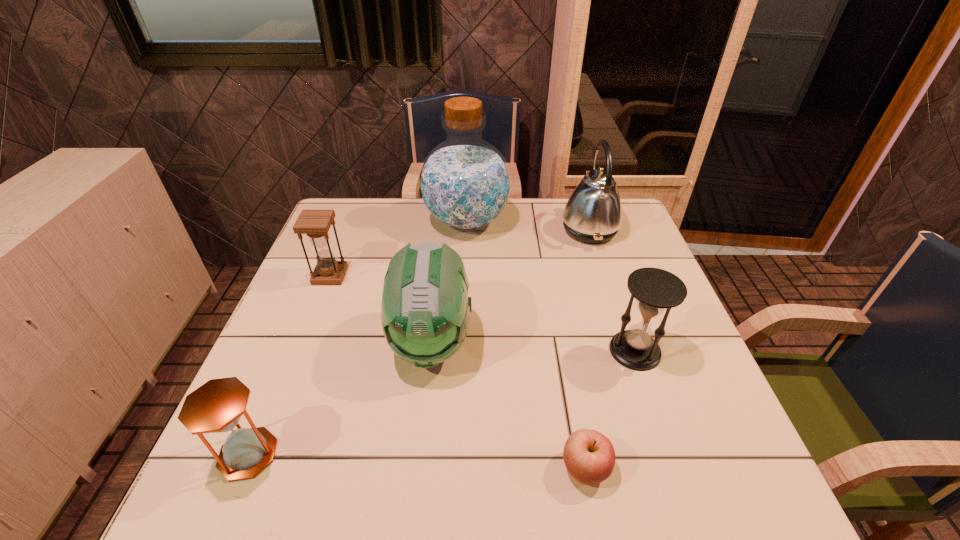
Find the location of a particular element. This screenshot has width=960, height=540. apple at the near edge is located at coordinates (589, 456).

Locate an element on the screen. The image size is (960, 540). kettle that is at the right edge is located at coordinates (593, 214).

Where is `hourglass that is at the right edge`? This screenshot has width=960, height=540. hourglass that is at the right edge is located at coordinates (655, 290).

I want to click on object present at the near left corner, so click(215, 407).

Where is `object located in the far right corner section of the desktop`? object located in the far right corner section of the desktop is located at coordinates (593, 214).

The image size is (960, 540). I want to click on free space at the far edge, so 490,231.

Find the location of a particular element. free spot at the near edge of the desktop is located at coordinates (407, 480).

At what (x,y) coordinates should I click in order to perform the action: click on free space at the left edge of the desktop. Please return your answer as a coordinate pair (x, y). Looking at the image, I should click on (320, 330).

You are a GUI agent. You are given a task and a screenshot of the screen. Output one action in this format:
    pyautogui.click(x=<x>, y=<y>)
    Task: Click on the free space at the right edge of the desktop
    
    Given the screenshot: What is the action you would take?
    pyautogui.click(x=684, y=370)

The image size is (960, 540). In the image, there is a desktop. What are the coordinates of `vacant space at the far left corner` in the screenshot? It's located at (348, 235).